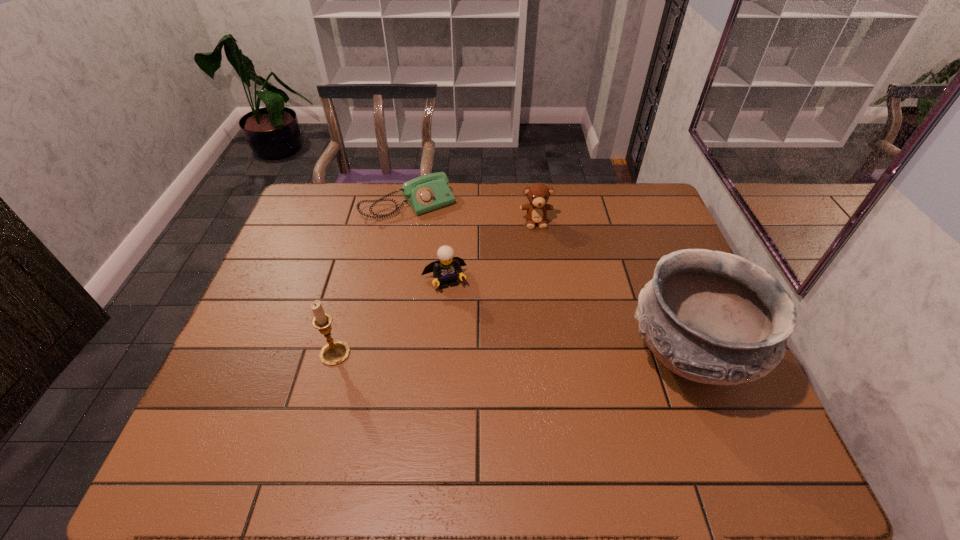
What are the coordinates of `object that is at the right edge` in the screenshot? It's located at (712, 317).

This screenshot has height=540, width=960. I want to click on object present at the near right corner, so click(712, 317).

At what (x,y) coordinates should I click in order to perform the action: click on free space at the far edge. Please return your answer as a coordinate pair (x, y). This screenshot has width=960, height=540. Looking at the image, I should click on (585, 184).

The height and width of the screenshot is (540, 960). I want to click on vacant space at the near edge of the desktop, so (294, 389).

In the image, there is a desktop. At what (x,y) coordinates should I click in order to perform the action: click on blank space at the left edge. Please return your answer as a coordinate pair (x, y). This screenshot has height=540, width=960. Looking at the image, I should click on 247,383.

Locate an element on the screen. Image resolution: width=960 pixels, height=540 pixels. free spot at the right edge of the desktop is located at coordinates (667, 253).

Identify the location of free space at the near left corner. (221, 418).

The height and width of the screenshot is (540, 960). In the image, there is a desktop. What are the coordinates of `free region at the far right corner` in the screenshot? It's located at click(652, 203).

Where is `vacant area that lies between the fourth shortest object and the telephone`? This screenshot has width=960, height=540. vacant area that lies between the fourth shortest object and the telephone is located at coordinates (372, 279).

Locate an element on the screen. empty space that is in between the telephone and the third nearest object is located at coordinates pyautogui.click(x=426, y=243).